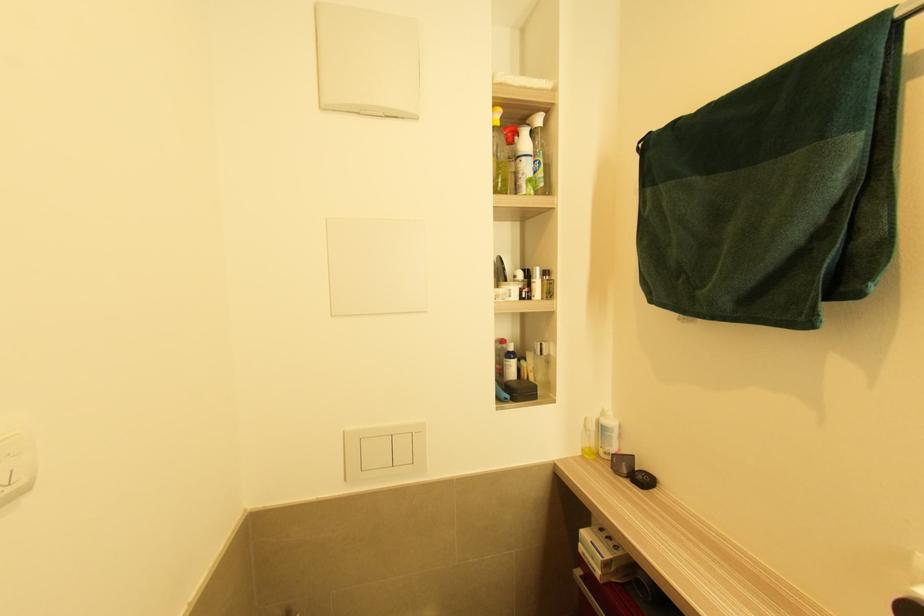
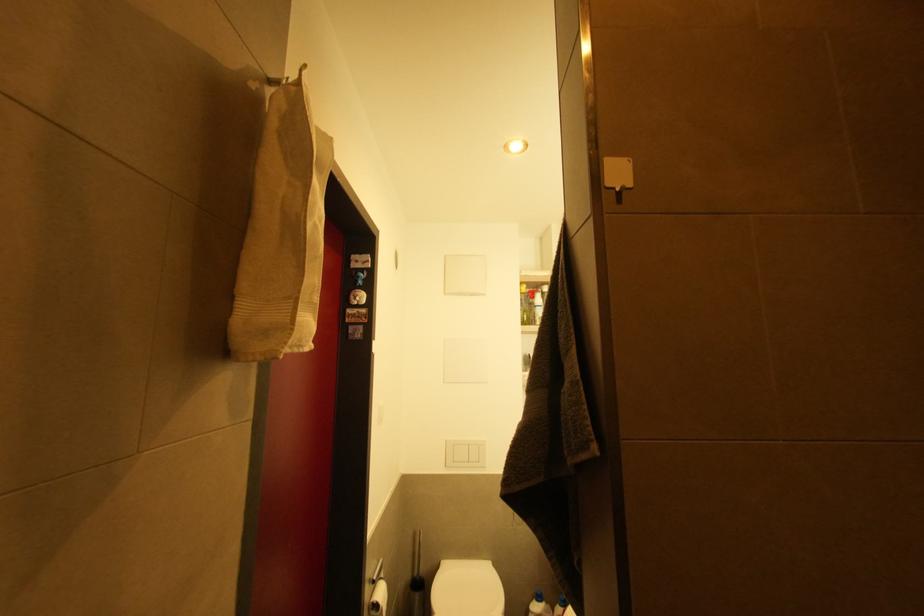
Question: In a continuous first-person perspective shot, in which direction is the camera moving?

Choices:
 (A) Left
 (B) Right
 (C) Forward
 (D) Backward

Answer: (D)